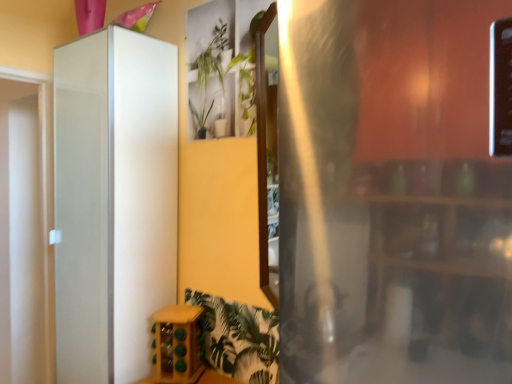
Locate an element on the screen. This screenshot has height=384, width=512. white glossy cabinet at left is located at coordinates (113, 201).

Where is `white glossy cabinet at left`? Image resolution: width=512 pixels, height=384 pixels. white glossy cabinet at left is located at coordinates (113, 201).

Are white glossy cabinet at left and green leafy plant at upper center beside each other?

white glossy cabinet at left is not next to green leafy plant at upper center, and they're not touching.

Which object is further away from the camera taking this photo, white glossy cabinet at left or green leafy plant at upper center?

white glossy cabinet at left is more distant.

Image resolution: width=512 pixels, height=384 pixels. I want to click on screen door below the green leafy plant at upper center (from a real-world perspective), so click(113, 201).

From the image's perspective, does white glossy cabinet at left appear higher than wooden wine rack at lower center?

Correct, white glossy cabinet at left appears higher than wooden wine rack at lower center in the image.

Considering the points (126, 89) and (173, 341), which point is in front, point (126, 89) or point (173, 341)?

Point (173, 341)

Which object is closer to the camera taking this photo, white glossy cabinet at left or wooden wine rack at lower center?

white glossy cabinet at left is closer to the camera.

Which is closer, (x=240, y=79) or (x=147, y=80)?

Point (x=240, y=79) is closer to the camera than point (x=147, y=80).

Are green leafy plant at upper center and white glossy cabinet at left beside each other?

green leafy plant at upper center and white glossy cabinet at left are clearly separated.

From the image's perspective, is green leafy plant at upper center below white glossy cabinet at left?

Incorrect, from the image's perspective, green leafy plant at upper center is higher than white glossy cabinet at left.

Can you tell me how much green leafy plant at upper center and white glossy cabinet at left differ in facing direction?

The angular difference between green leafy plant at upper center and white glossy cabinet at left is 1.74 degrees.

From the image's perspective, between wooden wine rack at lower center and white glossy cabinet at left, who is located below?

wooden wine rack at lower center appears lower in the image.

Can you confirm if wooden wine rack at lower center is smaller than white glossy cabinet at left?

Indeed, wooden wine rack at lower center has a smaller size compared to white glossy cabinet at left.

Is wooden wine rack at lower center oriented towards white glossy cabinet at left?

No, wooden wine rack at lower center does not turn towards white glossy cabinet at left.

Which is more to the left, wooden wine rack at lower center or white glossy cabinet at left?

Positioned to the left is white glossy cabinet at left.

From the image's perspective, is green leafy plant at upper center below wooden wine rack at lower center?

No.

The width and height of the screenshot is (512, 384). Identify the location of furniture behind the green leafy plant at upper center. (176, 344).

Would you say green leafy plant at upper center is to the left or to the right of wooden wine rack at lower center in the picture?

In the image, green leafy plant at upper center appears on the right side of wooden wine rack at lower center.

Does wooden wine rack at lower center have a greater width compared to green leafy plant at upper center?

Yes, wooden wine rack at lower center is wider than green leafy plant at upper center.

Based on their positions, is wooden wine rack at lower center located to the left or right of green leafy plant at upper center?

Clearly, wooden wine rack at lower center is on the left of green leafy plant at upper center in the image.

Are wooden wine rack at lower center and green leafy plant at upper center beside each other?

No, wooden wine rack at lower center is not with green leafy plant at upper center.

I want to click on screen door that is under the green leafy plant at upper center (from a real-world perspective), so click(x=113, y=201).

This screenshot has width=512, height=384. Find the location of `screen door above the wooden wine rack at lower center (from a real-world perspective)`. screen door above the wooden wine rack at lower center (from a real-world perspective) is located at coordinates (113, 201).

When comparing their distances from white glossy cabinet at left, does wooden wine rack at lower center or green leafy plant at upper center seem further?

green leafy plant at upper center is further to white glossy cabinet at left.

Which object lies further to the anchor point green leafy plant at upper center, wooden wine rack at lower center or white glossy cabinet at left?

wooden wine rack at lower center is positioned further to the anchor green leafy plant at upper center.

From the image, which object appears to be farther from wooden wine rack at lower center, white glossy cabinet at left or green leafy plant at upper center?

Among the two, green leafy plant at upper center is located further to wooden wine rack at lower center.

Considering their positions, is green leafy plant at upper center positioned closer to wooden wine rack at lower center than white glossy cabinet at left?

white glossy cabinet at left is closer to wooden wine rack at lower center.

Based on the photo, which object lies nearer to the anchor point green leafy plant at upper center, white glossy cabinet at left or wooden wine rack at lower center?

white glossy cabinet at left is closer to green leafy plant at upper center.

From the image, which object appears to be farther from white glossy cabinet at left, green leafy plant at upper center or wooden wine rack at lower center?

green leafy plant at upper center lies further to white glossy cabinet at left than the other object.

Locate an element on the screen. This screenshot has height=384, width=512. screen door between green leafy plant at upper center and wooden wine rack at lower center vertically is located at coordinates (113, 201).